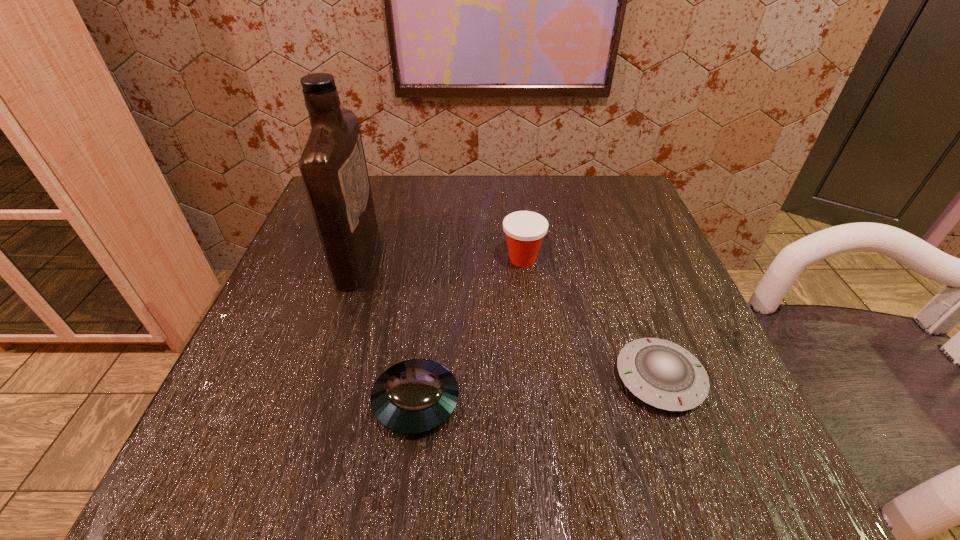
In the image, there is a desktop. Where is `free space at the right edge`? free space at the right edge is located at coordinates (723, 366).

Identify the location of vacant space at the far left corner of the desktop. The height and width of the screenshot is (540, 960). click(x=310, y=225).

At what (x,y) coordinates should I click in order to perform the action: click on vacant position at the near left corner of the desktop. Please return your answer as a coordinate pair (x, y). The image size is (960, 540). Looking at the image, I should click on [205, 429].

The width and height of the screenshot is (960, 540). Identify the location of vacant space at the far right corner. (627, 175).

In order to click on vacant space that is in between the Dixie cup and the shortest object in this screenshot , I will do `click(591, 319)`.

The height and width of the screenshot is (540, 960). I want to click on free space between the leftmost object and the shorter saucer, so click(509, 317).

Identify the location of empty space that is in between the liquor and the third object from left to right. (441, 258).

Where is `unoccupied position between the second tallest object and the shorter saucer`? The height and width of the screenshot is (540, 960). unoccupied position between the second tallest object and the shorter saucer is located at coordinates (591, 319).

The width and height of the screenshot is (960, 540). What are the coordinates of `vacant space that's between the second object from right to left and the right saucer` in the screenshot? It's located at (591, 319).

This screenshot has height=540, width=960. What are the coordinates of `free space between the third shortest object and the left saucer` in the screenshot? It's located at (469, 330).